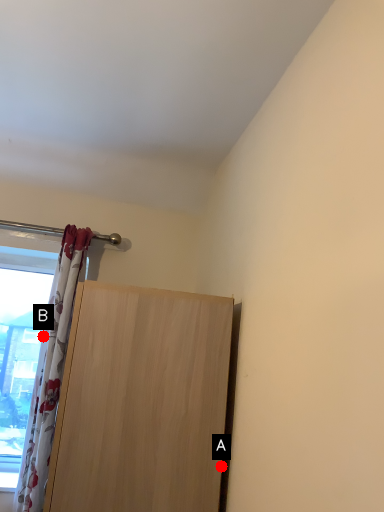
Question: Two points are circled on the image, labeled by A and B beside each circle. Which point is farther from the camera taking this photo?

Choices:
 (A) A is further
 (B) B is further

Answer: (B)